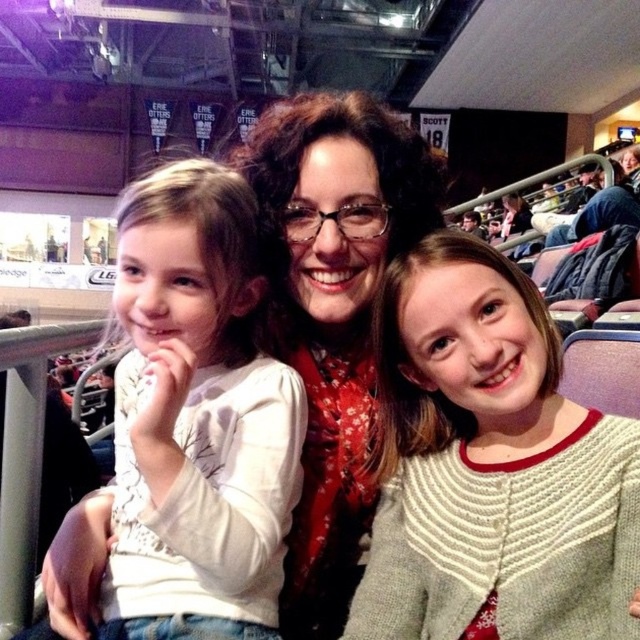
Locate an element on the screen. Image resolution: width=640 pixels, height=640 pixels. white knitted cardigan at center is located at coordinates (490, 467).

Between white knitted cardigan at center and white matte shirt at center, which one appears on the left side from the viewer's perspective?

white matte shirt at center is more to the left.

Image resolution: width=640 pixels, height=640 pixels. What do you see at coordinates (490, 467) in the screenshot?
I see `white knitted cardigan at center` at bounding box center [490, 467].

Where is `white knitted cardigan at center`? white knitted cardigan at center is located at coordinates [x=490, y=467].